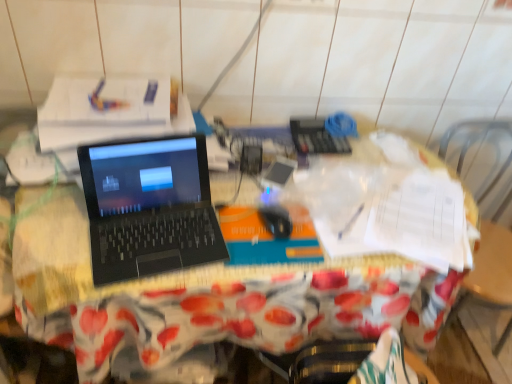
Question: Considering the relative sizes of black matte laptop at center and black matte mouse at center in the image provided, is black matte laptop at center taller than black matte mouse at center?

Choices:
 (A) no
 (B) yes

Answer: (B)

Question: Is black matte laptop at center further to the viewer compared to black matte mouse at center?

Choices:
 (A) no
 (B) yes

Answer: (A)

Question: Can you confirm if black matte laptop at center is shorter than black matte mouse at center?

Choices:
 (A) no
 (B) yes

Answer: (A)

Question: Is black matte laptop at center oriented towards black matte mouse at center?

Choices:
 (A) no
 (B) yes

Answer: (A)

Question: From the image's perspective, is black matte laptop at center over black matte mouse at center?

Choices:
 (A) no
 (B) yes

Answer: (B)

Question: From a real-world perspective, is black matte laptop at center located beneath black matte mouse at center?

Choices:
 (A) no
 (B) yes

Answer: (A)

Question: Considering the relative sizes of black plastic laptop at center and black matte mouse at center in the image provided, is black plastic laptop at center thinner than black matte mouse at center?

Choices:
 (A) yes
 (B) no

Answer: (B)

Question: Is black plastic laptop at center placed right next to black matte mouse at center?

Choices:
 (A) yes
 (B) no

Answer: (B)

Question: Are black plastic laptop at center and black matte mouse at center far apart?

Choices:
 (A) yes
 (B) no

Answer: (B)

Question: From the image's perspective, would you say black plastic laptop at center is shown under black matte mouse at center?

Choices:
 (A) yes
 (B) no

Answer: (A)

Question: Can you confirm if black plastic laptop at center is shorter than black matte mouse at center?

Choices:
 (A) no
 (B) yes

Answer: (A)

Question: Is black plastic laptop at center positioned behind black matte mouse at center?

Choices:
 (A) no
 (B) yes

Answer: (A)

Question: From a real-world perspective, is black plastic laptop at center positioned under black matte laptop at center based on gravity?

Choices:
 (A) yes
 (B) no

Answer: (A)